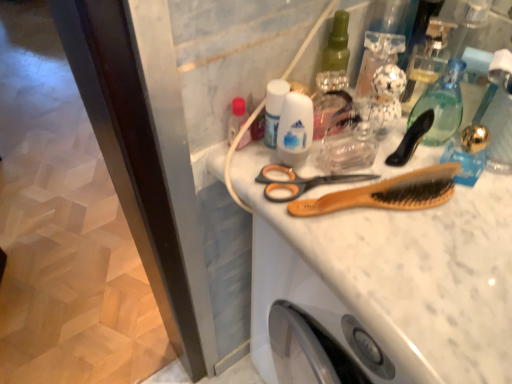
Image resolution: width=512 pixels, height=384 pixels. I want to click on spots to the right of wooden comb at center, so point(463,224).